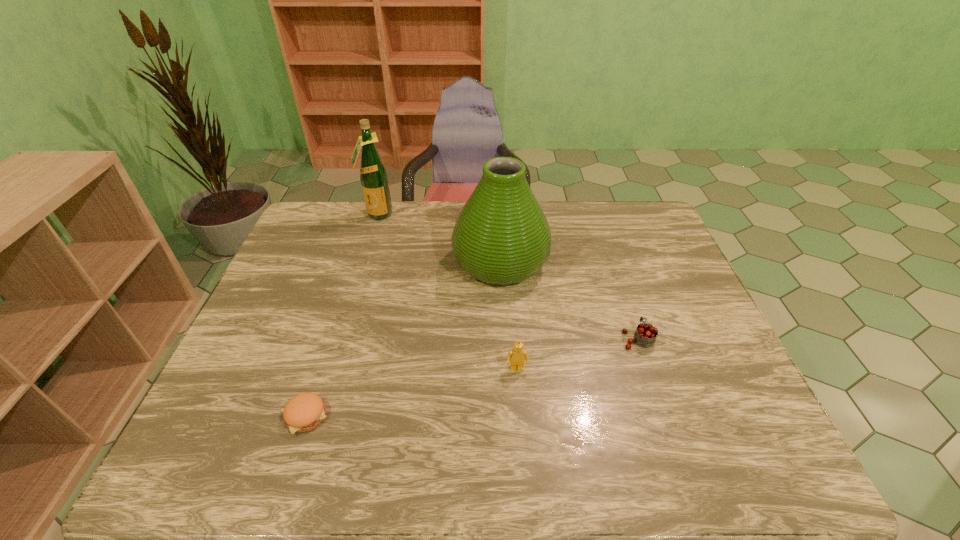
The width and height of the screenshot is (960, 540). In order to click on free spot between the rightmost object and the Lego in this screenshot , I will do `click(577, 354)`.

This screenshot has width=960, height=540. I want to click on free space between the Lego and the vase, so click(509, 316).

You are a GUI agent. You are given a task and a screenshot of the screen. Output one action in this format:
    pyautogui.click(x=<x>, y=<y>)
    Task: Click on the object that ranks as the third closest to the second shortest object
    The width and height of the screenshot is (960, 540).
    Given the screenshot: What is the action you would take?
    point(304,412)

Select which object appears as the second closest to the Lego. Please provide its 2D coordinates. Your answer should be formatted as a tuple, i.e. [(x, y)], where the tuple contains the x and y coordinates of a point satisfying the conditions above.

[(645, 335)]

Find the location of a particular element. This screenshot has width=960, height=540. vacant area that satisfies the following two spatial constraints: 1. on the front-facing side of the fourth nearest object; 2. on the right side of the farthest object is located at coordinates (362, 262).

Image resolution: width=960 pixels, height=540 pixels. What are the coordinates of `vacant position in the image that satisfies the following two spatial constraints: 1. on the back side of the second farthest object; 2. on the right side of the nearest object` in the screenshot? It's located at (355, 262).